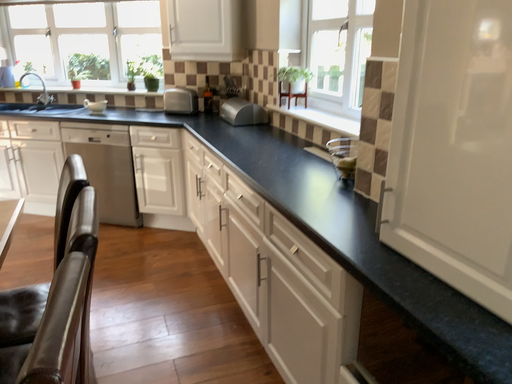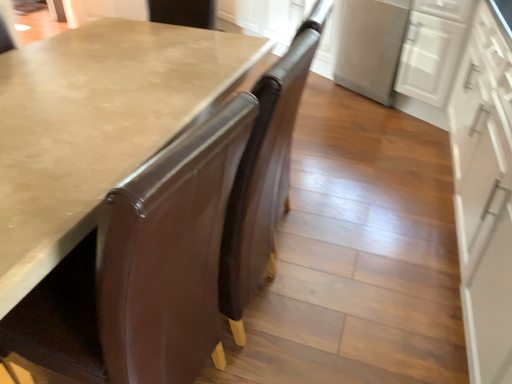
Question: How did the camera likely rotate when shooting the video?

Choices:
 (A) rotated right
 (B) rotated left

Answer: (B)